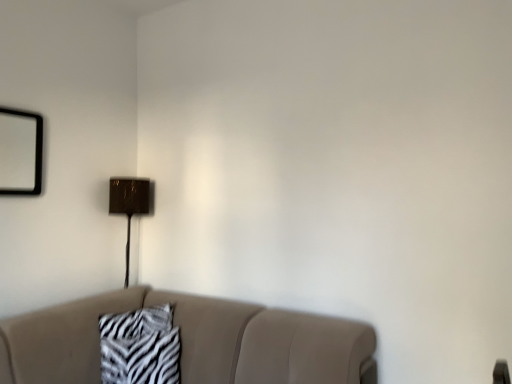
Question: Does zebra-patterned fabric at center have a greater height compared to metallic gold table lamp at upper center?

Choices:
 (A) yes
 (B) no

Answer: (B)

Question: Considering the relative sizes of zebra-patterned fabric at center and metallic gold table lamp at upper center in the image provided, is zebra-patterned fabric at center smaller than metallic gold table lamp at upper center?

Choices:
 (A) no
 (B) yes

Answer: (B)

Question: From the image's perspective, would you say zebra-patterned fabric at center is shown under metallic gold table lamp at upper center?

Choices:
 (A) no
 (B) yes

Answer: (B)

Question: Does zebra-patterned fabric at center have a lesser height compared to metallic gold table lamp at upper center?

Choices:
 (A) yes
 (B) no

Answer: (A)

Question: Does zebra-patterned fabric at center have a larger size compared to metallic gold table lamp at upper center?

Choices:
 (A) no
 (B) yes

Answer: (A)

Question: Looking at their shapes, would you say metallic gold table lamp at upper center is wider or thinner than beige fabric couch at lower center?

Choices:
 (A) wide
 (B) thin

Answer: (B)

Question: From their relative heights in the image, would you say metallic gold table lamp at upper center is taller or shorter than beige fabric couch at lower center?

Choices:
 (A) short
 (B) tall

Answer: (B)

Question: Is metallic gold table lamp at upper center in front of or behind beige fabric couch at lower center in the image?

Choices:
 (A) behind
 (B) front

Answer: (A)

Question: From the image's perspective, relative to beige fabric couch at lower center, is metallic gold table lamp at upper center above or below?

Choices:
 (A) above
 (B) below

Answer: (A)

Question: Is beige fabric couch at lower center bigger or smaller than zebra-patterned fabric at center?

Choices:
 (A) small
 (B) big

Answer: (B)

Question: Relative to zebra-patterned fabric at center, is beige fabric couch at lower center in front or behind?

Choices:
 (A) front
 (B) behind

Answer: (A)

Question: Which is correct: beige fabric couch at lower center is inside zebra-patterned fabric at center, or outside of it?

Choices:
 (A) outside
 (B) inside

Answer: (A)

Question: Based on their positions, is beige fabric couch at lower center located to the left or right of zebra-patterned fabric at center?

Choices:
 (A) right
 (B) left

Answer: (A)

Question: Is zebra-patterned fabric at center inside or outside of metallic gold table lamp at upper center?

Choices:
 (A) inside
 (B) outside

Answer: (B)

Question: Is point (146, 326) closer or farther from the camera than point (126, 201)?

Choices:
 (A) closer
 (B) farther

Answer: (A)